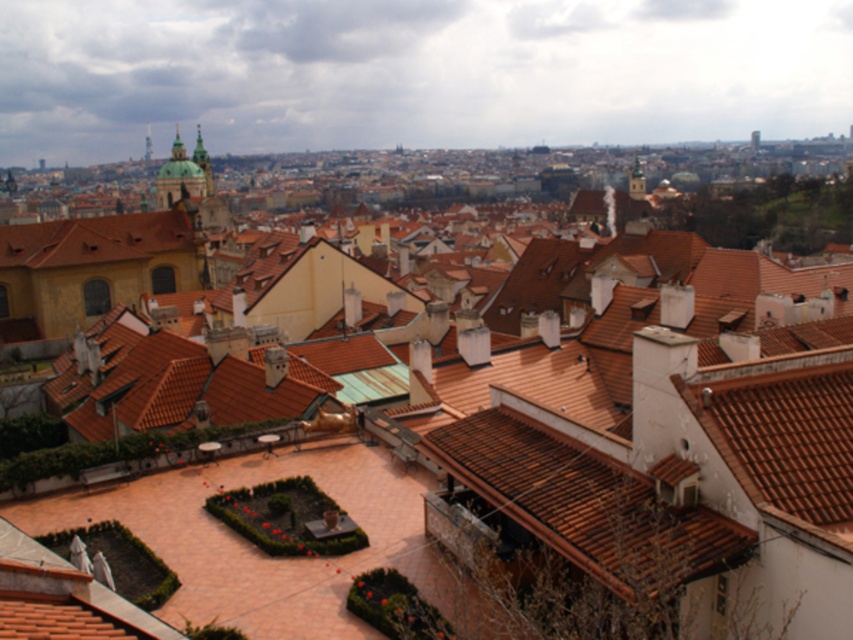
Which of these two, brown tile roof at center or matte orange tile roof at left, stands shorter?

Standing shorter between the two is brown tile roof at center.

Is brown tile roof at center further to camera compared to matte orange tile roof at left?

No, it is in front of matte orange tile roof at left.

Between point (512, 445) and point (19, 257), which one is positioned in front?

Point (512, 445) is more forward.

Where is `brown tile roof at center`? brown tile roof at center is located at coordinates (585, 502).